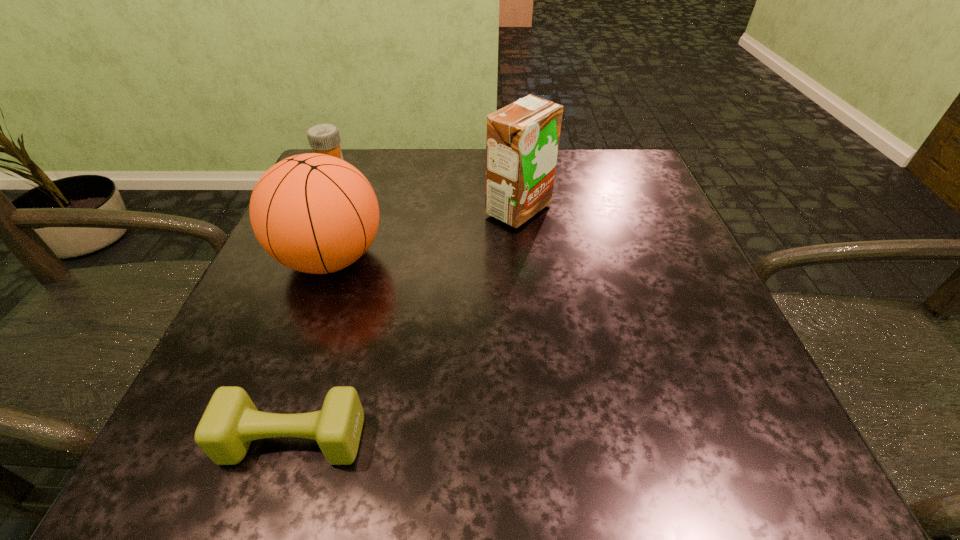
The image size is (960, 540). Find the location of `vacant region that satisfies the following two spatial constraints: 1. on the label side of the shortest object; 2. on the left side of the farthest object`. vacant region that satisfies the following two spatial constraints: 1. on the label side of the shortest object; 2. on the left side of the farthest object is located at coordinates (209, 440).

I want to click on vacant area in the image that satisfies the following two spatial constraints: 1. on the label side of the farthest object; 2. on the left side of the basketball, so (x=293, y=258).

Image resolution: width=960 pixels, height=540 pixels. I want to click on free space that satisfies the following two spatial constraints: 1. on the front side of the nearest object; 2. on the left side of the basketball, so 264,440.

Where is `vacant space that satisfies the following two spatial constraints: 1. on the label side of the farthest object; 2. on the left side of the shortest object`? This screenshot has height=540, width=960. vacant space that satisfies the following two spatial constraints: 1. on the label side of the farthest object; 2. on the left side of the shortest object is located at coordinates (209, 440).